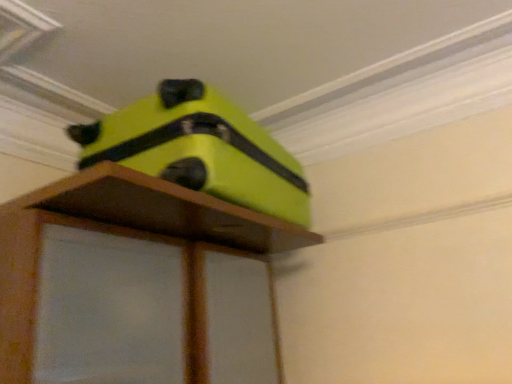
Identify the location of lime green plastic suitcase at center. coord(199,149).

What do you see at coordinates (199, 149) in the screenshot?
I see `lime green plastic suitcase at center` at bounding box center [199, 149].

Where is `lime green plastic suitcase at center`? The image size is (512, 384). lime green plastic suitcase at center is located at coordinates (199, 149).